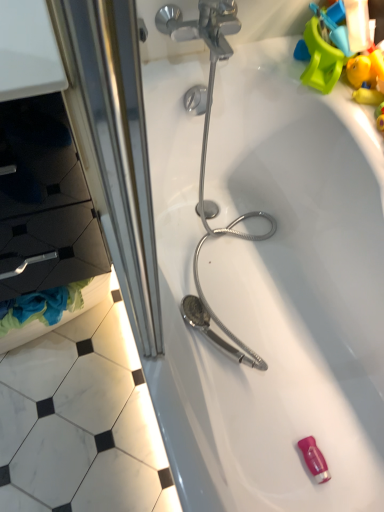
Question: Does black matte drawer at left have a greater width compared to white glossy bathtub at center?

Choices:
 (A) yes
 (B) no

Answer: (B)

Question: Is black matte drawer at left not inside white glossy bathtub at center?

Choices:
 (A) no
 (B) yes

Answer: (B)

Question: Can you confirm if black matte drawer at left is taller than white glossy bathtub at center?

Choices:
 (A) no
 (B) yes

Answer: (A)

Question: From a real-world perspective, is black matte drawer at left below white glossy bathtub at center?

Choices:
 (A) no
 (B) yes

Answer: (A)

Question: Is black matte drawer at left in contact with white glossy bathtub at center?

Choices:
 (A) no
 (B) yes

Answer: (A)

Question: From the image's perspective, is black matte drawer at left on top of white glossy bathtub at center?

Choices:
 (A) yes
 (B) no

Answer: (A)

Question: Considering the relative sizes of white glossy bathtub at center and black matte drawer at left in the image provided, is white glossy bathtub at center taller than black matte drawer at left?

Choices:
 (A) yes
 (B) no

Answer: (A)

Question: Is white glossy bathtub at center directly adjacent to black matte drawer at left?

Choices:
 (A) no
 (B) yes

Answer: (A)

Question: From the image's perspective, is white glossy bathtub at center on black matte drawer at left?

Choices:
 (A) no
 (B) yes

Answer: (A)

Question: Considering the relative sizes of white glossy bathtub at center and black matte drawer at left in the image provided, is white glossy bathtub at center thinner than black matte drawer at left?

Choices:
 (A) yes
 (B) no

Answer: (B)

Question: Does white glossy bathtub at center come behind black matte drawer at left?

Choices:
 (A) yes
 (B) no

Answer: (A)

Question: Is white glossy bathtub at center at the left side of black matte drawer at left?

Choices:
 (A) yes
 (B) no

Answer: (B)

Question: Is white glossy bathtub at center bigger or smaller than black matte drawer at left?

Choices:
 (A) small
 (B) big

Answer: (B)